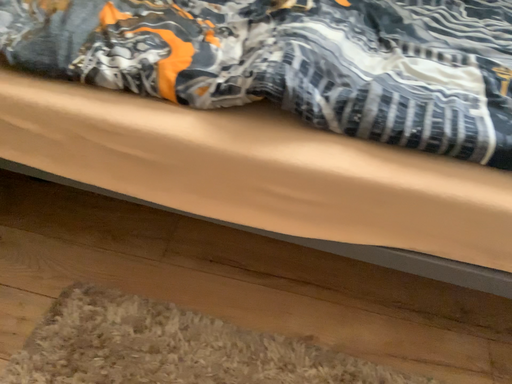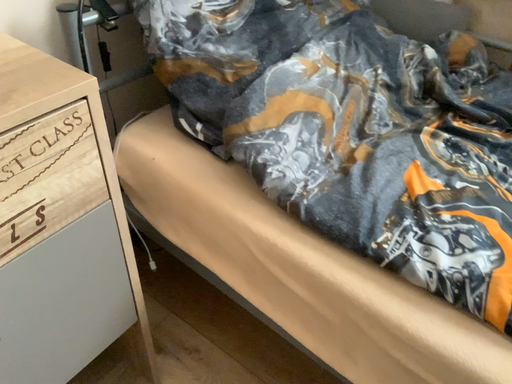
Question: Which way did the camera rotate in the video?

Choices:
 (A) rotated downward
 (B) rotated upward

Answer: (B)